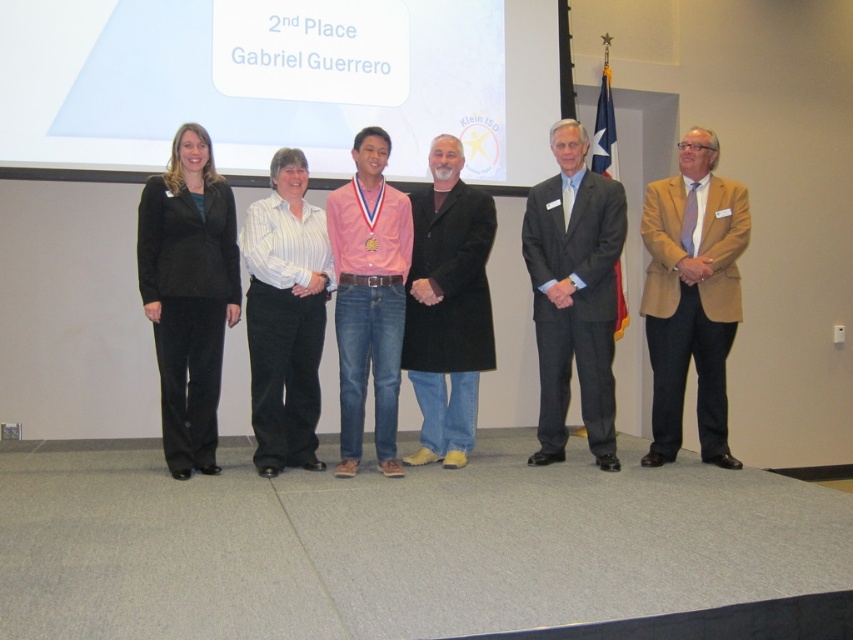
In the scene shown: Measure the distance from black wool coat at center to pink cotton shirt at center.

black wool coat at center is 11.23 inches away from pink cotton shirt at center.

Which is more to the left, black wool coat at center or pink cotton shirt at center?

pink cotton shirt at center

This screenshot has height=640, width=853. What do you see at coordinates (447, 307) in the screenshot?
I see `black wool coat at center` at bounding box center [447, 307].

This screenshot has height=640, width=853. In order to click on black wool coat at center in this screenshot , I will do `click(447, 307)`.

Locate an element on the screen. Image resolution: width=853 pixels, height=640 pixels. black velvet pants at left is located at coordinates (189, 292).

Can you confirm if black velvet pants at left is taller than pink cotton shirt at center?

No, black velvet pants at left is not taller than pink cotton shirt at center.

What do you see at coordinates (189, 292) in the screenshot? This screenshot has width=853, height=640. I see `black velvet pants at left` at bounding box center [189, 292].

Find the location of a particular element. black velvet pants at left is located at coordinates (189, 292).

Is gray suit at center bigger than white striped shirt at center?

Yes.

Which is more to the right, gray suit at center or white striped shirt at center?

Positioned to the right is gray suit at center.

The height and width of the screenshot is (640, 853). Describe the element at coordinates (573, 292) in the screenshot. I see `gray suit at center` at that location.

Locate an element on the screen. The image size is (853, 640). gray suit at center is located at coordinates (573, 292).